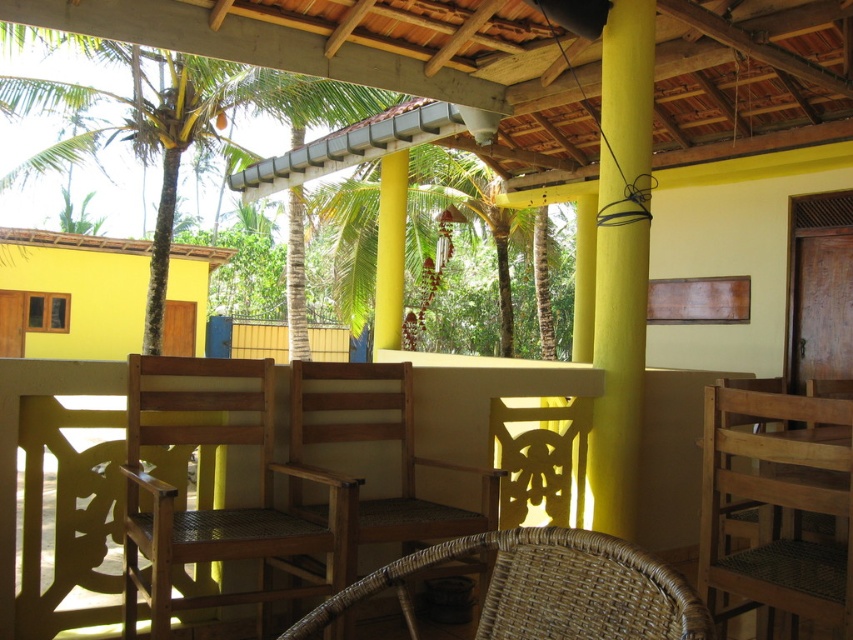
You are standing at point (619, 70) and want to walk to the yellow wall in the scene. Is the point (671, 472) located behind you or in front of you as you face the yellow wall?

Point (671, 472) is behind point (619, 70), so if you are facing the yellow wall at point (619, 70), the point (671, 472) would be behind you.

Based on the photo, you are planning to place a new potted plant in the center of the patio. Currently, there are natural wood chairs at center and a green leafy palm tree at upper left. Which object is located to the right of the palm tree?

The natural wood chairs at center are positioned on the right side of the green leafy palm tree at upper left, so the natural wood chairs at center are to the right of the palm tree.

You are standing at the entrance of the patio and want to sit down. Which object at point (479, 396) should you head towards?

You should head towards the natural wood chairs at center located at point (479, 396).